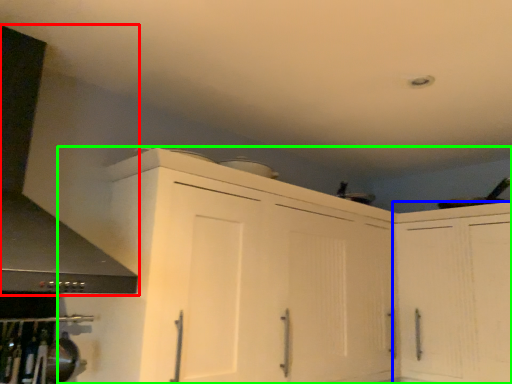
Question: Which is farther away from exhaust hood (highlighted by a red box)? cabinetry (highlighted by a blue box) or cabinetry (highlighted by a green box)?

Choices:
 (A) cabinetry
 (B) cabinetry

Answer: (A)